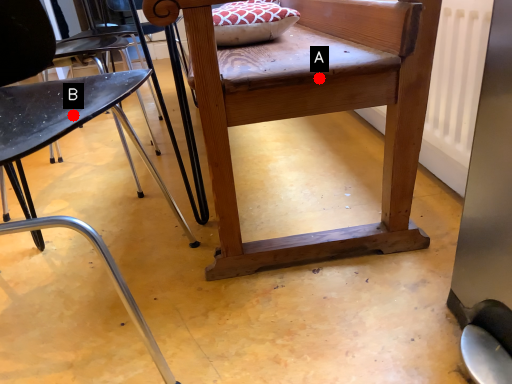
Question: Two points are circled on the image, labeled by A and B beside each circle. Which point is closer to the camera taking this photo?

Choices:
 (A) A is closer
 (B) B is closer

Answer: (B)